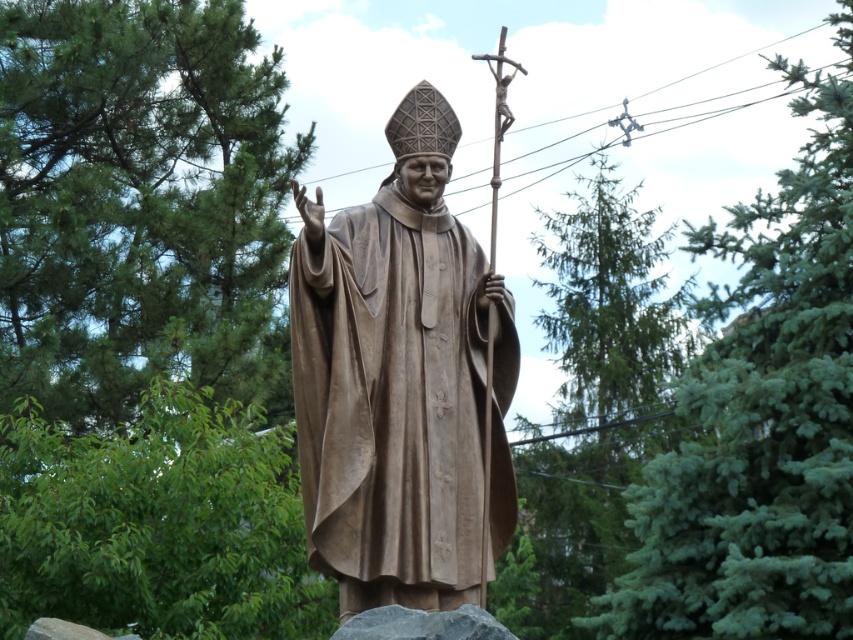
You are a landscape architect designing a garden layout. You need to place a new statue in an area where it can be seen from both the green leafy tree at upper left and the green coniferous tree at upper right. Considering their sizes, which tree would allow a better view of the statue?

The green coniferous tree at upper right is larger than the green leafy tree at upper left, so placing the statue near the green coniferous tree at upper right would provide a better vantage point for visibility from both trees.